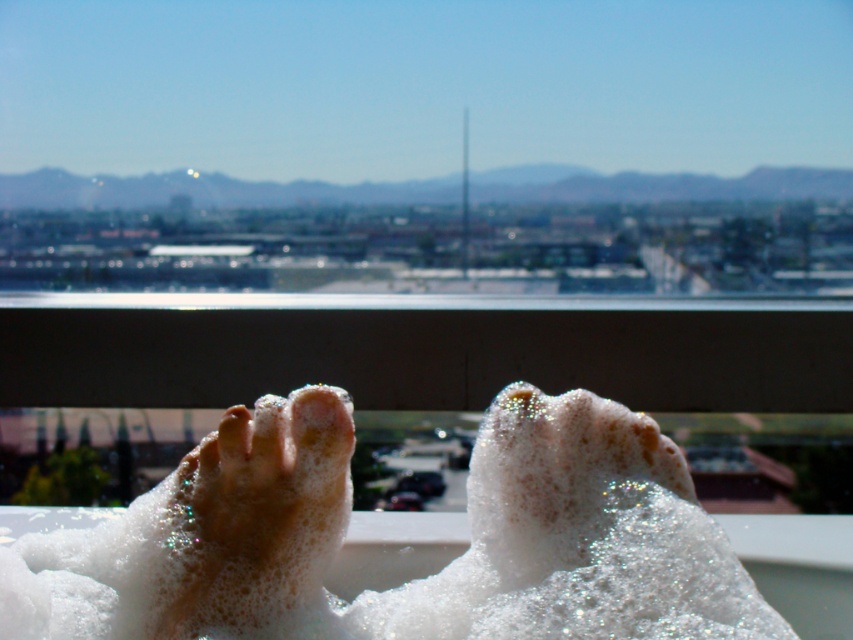
Who is positioned more to the right, white foamy feet at lower center or smooth skin toe at center?

white foamy feet at lower center

Identify the location of white foamy feet at lower center. (413, 580).

Does white foamy feet at lower center have a greater width compared to frothy white foot at lower left?

Yes.

Between point (171, 541) and point (288, 564), which one is positioned in front?

Point (171, 541) is more forward.

Who is more forward, (x=120, y=636) or (x=178, y=476)?

Point (x=120, y=636) is in front.

Identify the location of white foamy feet at lower center. Image resolution: width=853 pixels, height=640 pixels. (413, 580).

Can you confirm if frothy white foot at lower left is thinner than smooth skin toe at center?

No, frothy white foot at lower left is not thinner than smooth skin toe at center.

Is frothy white foot at lower left smaller than smooth skin toe at center?

Actually, frothy white foot at lower left might be larger than smooth skin toe at center.

Where is `frothy white foot at lower left`? Image resolution: width=853 pixels, height=640 pixels. frothy white foot at lower left is located at coordinates (257, 516).

At what (x,y) coordinates should I click in order to perform the action: click on frothy white foot at lower left. Please return your answer as a coordinate pair (x, y). Looking at the image, I should click on (257, 516).